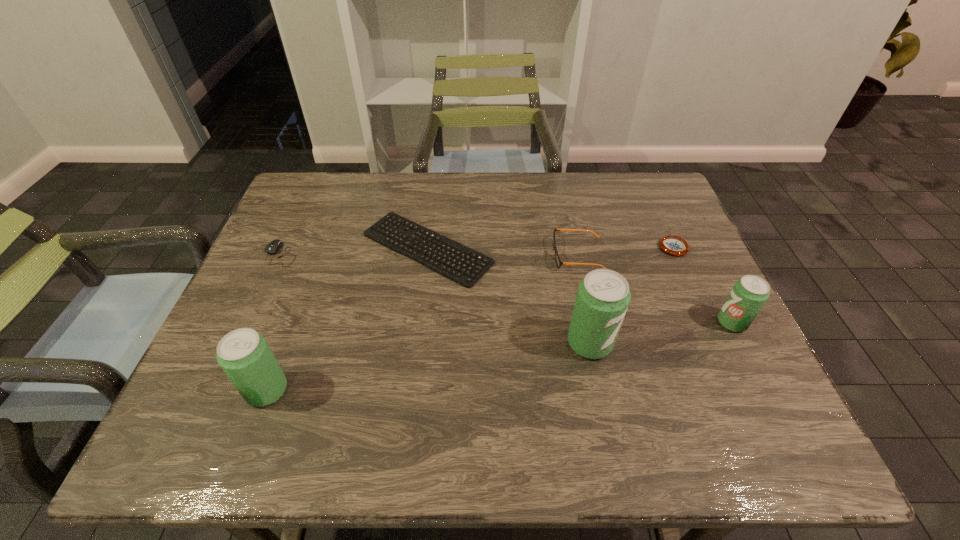
The width and height of the screenshot is (960, 540). Identify the location of object that is at the far edge. (385, 225).

Where is `object that is positioned at the near edge`? This screenshot has height=540, width=960. object that is positioned at the near edge is located at coordinates (245, 356).

Image resolution: width=960 pixels, height=540 pixels. Identify the location of soda located in the left edge section of the desktop. (245, 356).

You are a GUI agent. You are given a task and a screenshot of the screen. Output one action in this format:
    pyautogui.click(x=<x>, y=<y>)
    Task: Click on the computer mouse that is positioned at the left edge
    This screenshot has height=540, width=960.
    Given the screenshot: What is the action you would take?
    pyautogui.click(x=272, y=248)

What are the coordinates of `soda that is at the right edge` in the screenshot? It's located at (749, 294).

Locate an element on the screen. This screenshot has height=540, width=960. compass that is at the right edge is located at coordinates (674, 245).

The width and height of the screenshot is (960, 540). Identify the location of object that is positioned at the near left corner. (245, 356).

Identify the location of free region at the far edge. Image resolution: width=960 pixels, height=540 pixels. (586, 184).

The width and height of the screenshot is (960, 540). What are the coordinates of `vacant region at the near edge of the desktop` in the screenshot? It's located at (588, 396).

In the image, there is a desktop. Find the location of `free space at the right edge`. free space at the right edge is located at coordinates (679, 353).